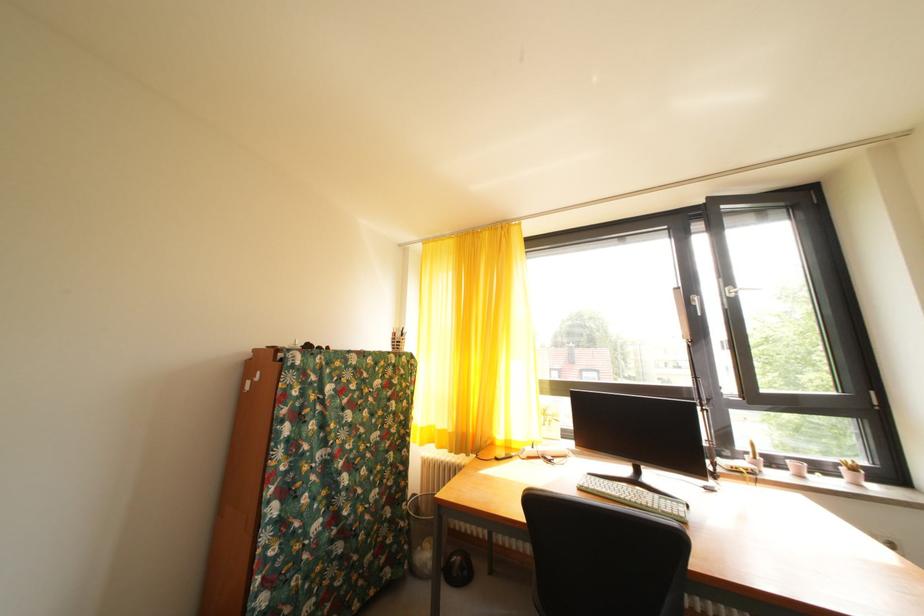
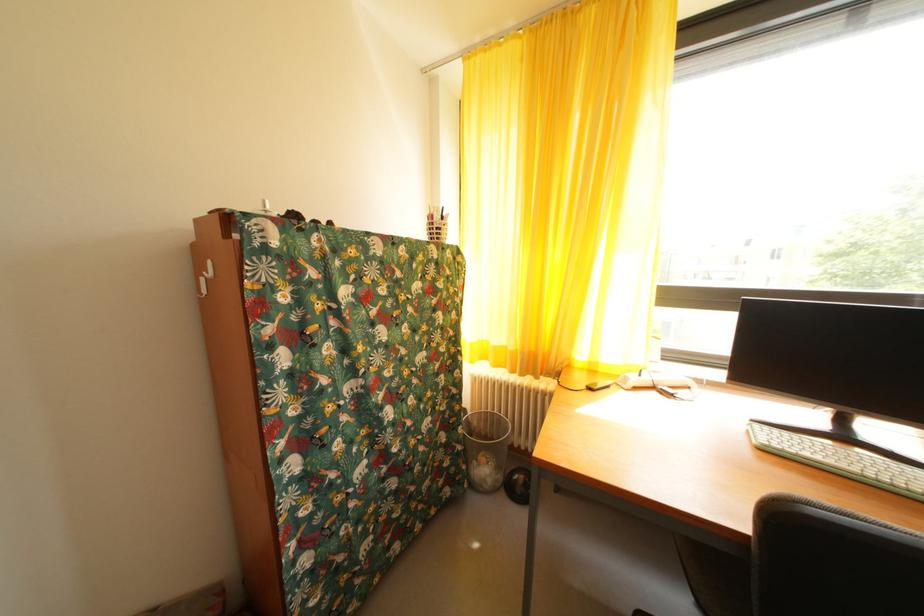
Where in the second image is the point corresponding to (x=410, y=530) from the first image?

(468, 454)